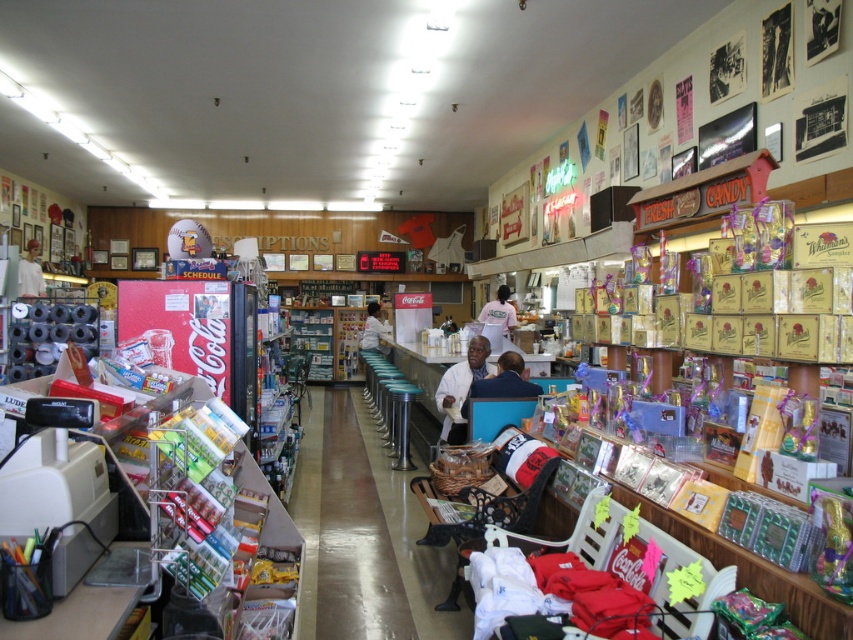
Question: Considering the real-world distances, which object is farthest from the white fabric shirt at left?

Choices:
 (A) white matte shirt at center
 (B) white fabric shirt at center
 (C) metallic polished counter at center

Answer: (A)

Question: Does white shirt at center lie in front of white fabric shirt at left?

Choices:
 (A) yes
 (B) no

Answer: (A)

Question: Is white matte shirt at center to the right of white fabric shirt at center from the viewer's perspective?

Choices:
 (A) yes
 (B) no

Answer: (A)

Question: Is white matte shirt at center to the right of white fabric shirt at center from the viewer's perspective?

Choices:
 (A) no
 (B) yes

Answer: (B)

Question: Which point is closer to the camera?

Choices:
 (A) metallic polished counter at center
 (B) white cotton shirt at center
 (C) white fabric shirt at left
 (D) white fabric shirt at center

Answer: (A)

Question: Estimate the real-world distances between objects in this image. Which object is closer to the white fabric shirt at left?

Choices:
 (A) metallic polished counter at center
 (B) white fabric shirt at center
 (C) white shirt at center
 (D) white matte shirt at center

Answer: (B)